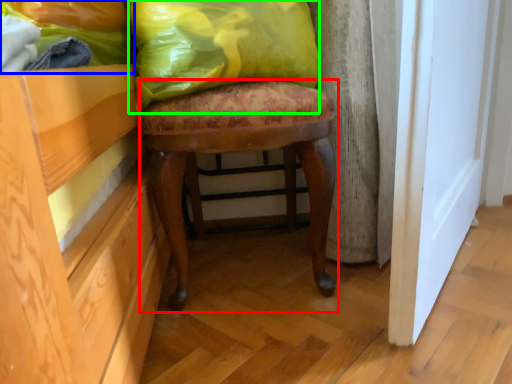
Question: Which object is the farthest from stool (highlighted by a red box)? Choose among these: fabric (highlighted by a blue box) or throw pillow (highlighted by a green box).

Choices:
 (A) fabric
 (B) throw pillow

Answer: (A)